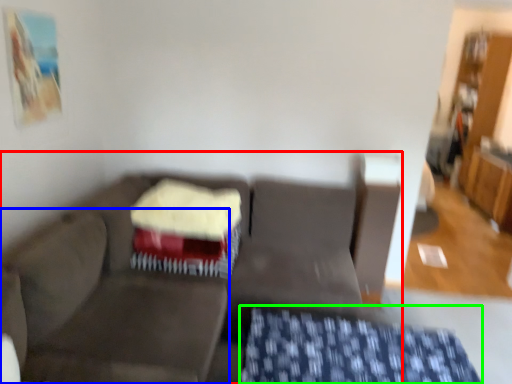
Question: Estimate the real-world distances between objects in this image. Which object is closer to studio couch (highlighted by a red box), swivel chair (highlighted by a blue box) or tablecloth (highlighted by a green box)?

Choices:
 (A) swivel chair
 (B) tablecloth

Answer: (A)